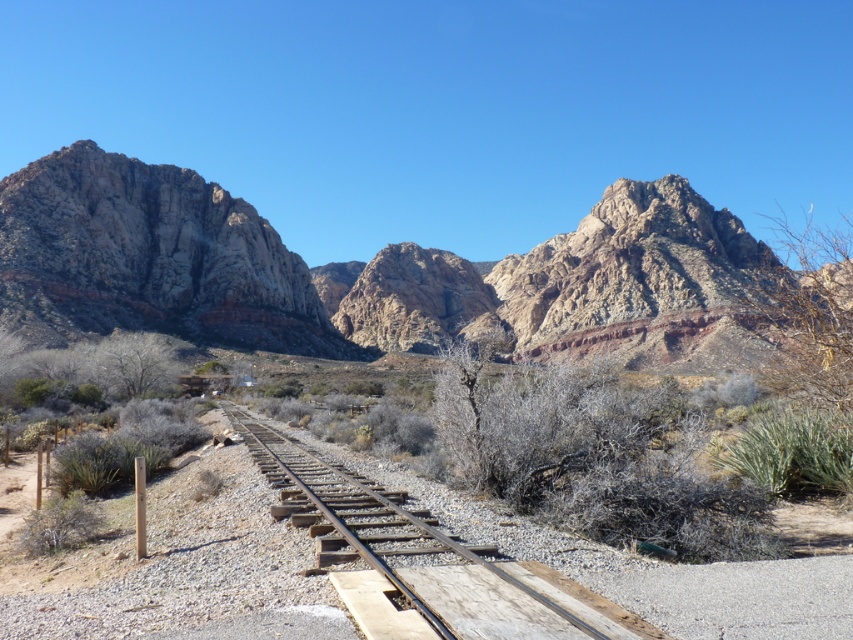
Question: Does rugged rock mountain range at upper left appear on the right side of rusty metal train track at center?

Choices:
 (A) no
 (B) yes

Answer: (B)

Question: Can you confirm if rugged rock formation at left is positioned above rusty metal train track at center?

Choices:
 (A) yes
 (B) no

Answer: (A)

Question: Is rugged rock mountain range at upper left above rugged rock formation at left?

Choices:
 (A) yes
 (B) no

Answer: (A)

Question: Estimate the real-world distances between objects in this image. Which object is farther from the rusty metal train track at center?

Choices:
 (A) rugged rock formation at left
 (B) rugged rock mountain range at upper left

Answer: (B)

Question: Based on their relative distances, which object is nearer to the rugged rock mountain range at upper left?

Choices:
 (A) rugged rock formation at left
 (B) rusty metal train track at center

Answer: (A)

Question: Among these points, which one is farthest from the camera?

Choices:
 (A) (264, 252)
 (B) (553, 337)
 (C) (428, 547)

Answer: (B)